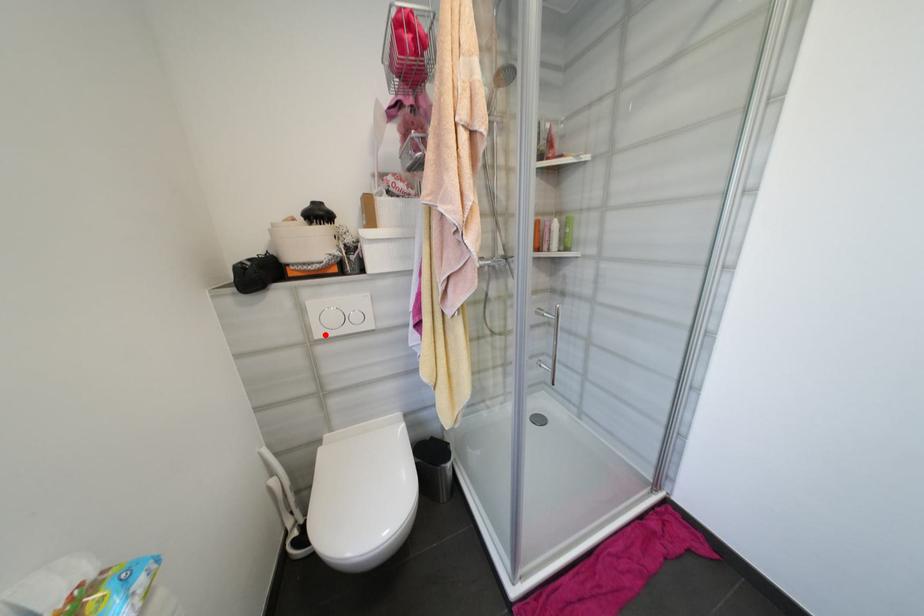
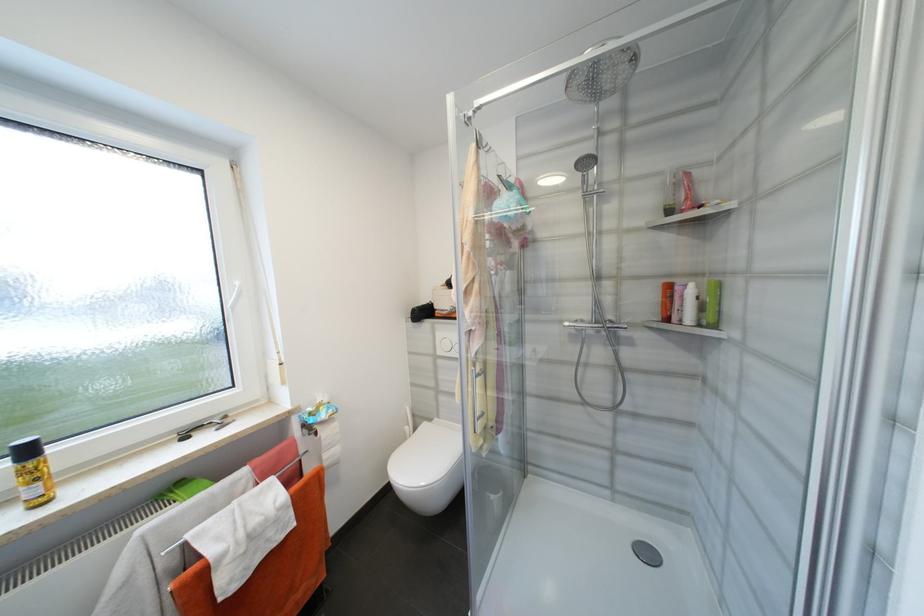
The point at the highlighted location is marked in the first image. Where is the corresponding point in the second image?

(445, 353)